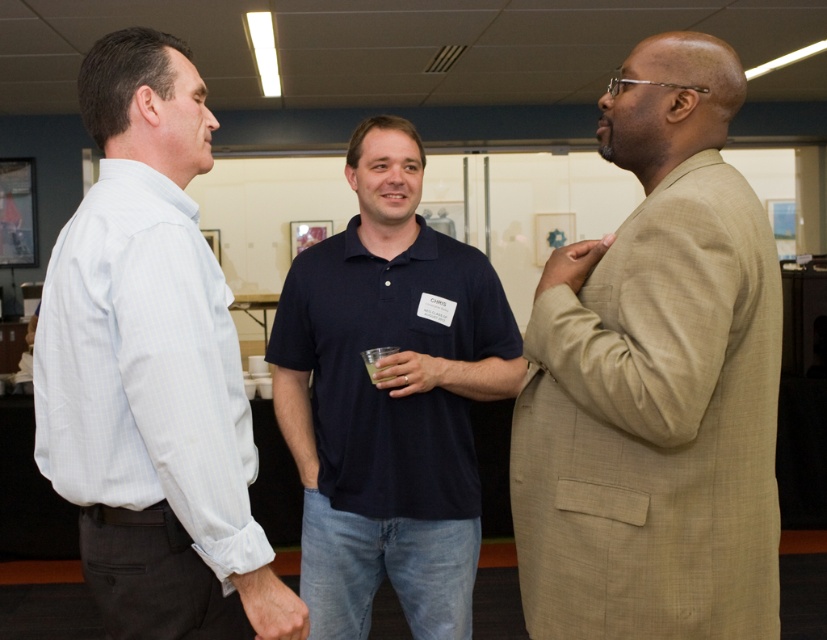
Question: Estimate the real-world distances between objects in this image. Which object is closer to the dark blue cotton polo shirt at center?

Choices:
 (A) translucent plastic cup at center
 (B) tan textured suit at right
 (C) light blue striped shirt at left

Answer: (A)

Question: From the image, what is the correct spatial relationship of tan textured suit at right in relation to translucent plastic cup at center?

Choices:
 (A) left
 (B) right

Answer: (B)

Question: Which object is positioned farthest from the light blue striped shirt at left?

Choices:
 (A) tan textured suit at right
 (B) translucent plastic cup at center

Answer: (B)

Question: Does light blue striped shirt at left appear on the right side of dark blue cotton polo shirt at center?

Choices:
 (A) no
 (B) yes

Answer: (A)

Question: Which point appears farthest from the camera in this image?

Choices:
 (A) (519, 364)
 (B) (84, 461)

Answer: (A)

Question: Is tan textured suit at right wider than dark blue cotton polo shirt at center?

Choices:
 (A) no
 (B) yes

Answer: (A)